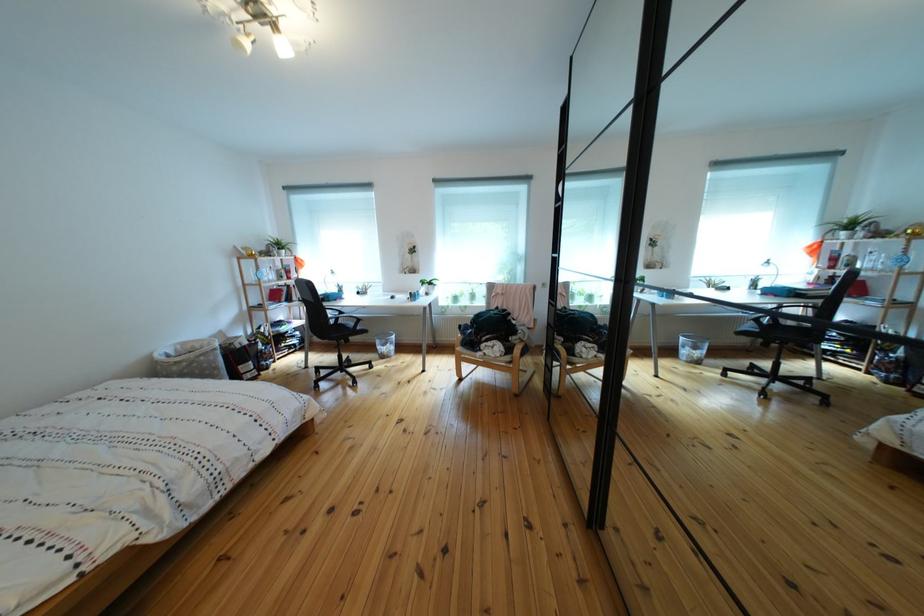
The width and height of the screenshot is (924, 616). Describe the element at coordinates (275, 294) in the screenshot. I see `a red book` at that location.